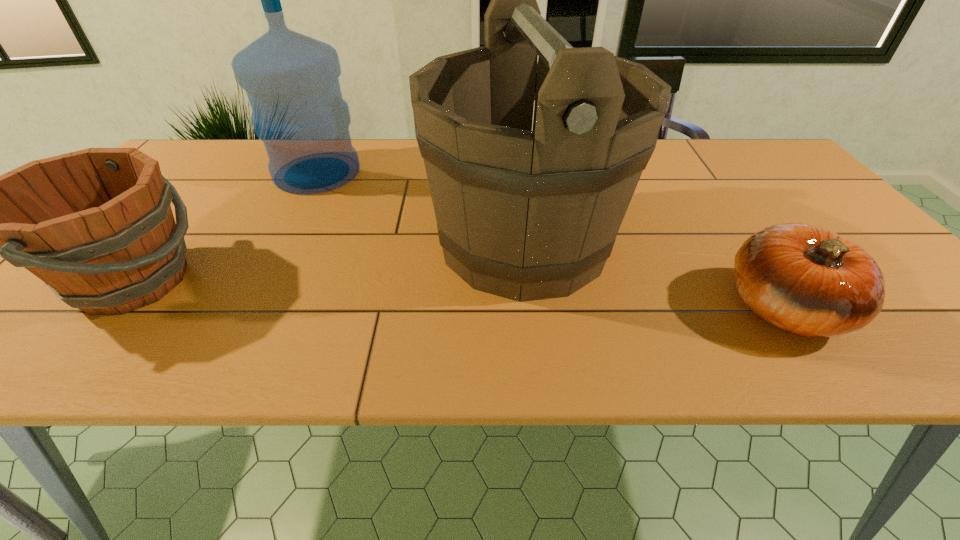
Where is `blank region between the second object from left to right and the taller bucket`? The height and width of the screenshot is (540, 960). blank region between the second object from left to right and the taller bucket is located at coordinates (420, 207).

The width and height of the screenshot is (960, 540). What are the coordinates of `object that is the second closest to the third object from right to left` in the screenshot? It's located at (536, 212).

This screenshot has height=540, width=960. What are the coordinates of `object that is the third closest one to the shortest object` in the screenshot? It's located at (96, 226).

The height and width of the screenshot is (540, 960). I want to click on free location that satisfies the following two spatial constraints: 1. on the front side of the shortest object; 2. on the right side of the taller bucket, so click(x=531, y=308).

The width and height of the screenshot is (960, 540). I want to click on vacant region that satisfies the following two spatial constraints: 1. on the front side of the rightmost object; 2. on the left side of the right bucket, so click(x=531, y=308).

This screenshot has height=540, width=960. In order to click on blank space that satisfies the following two spatial constraints: 1. on the handle side of the leftmost object; 2. on the back side of the rightmost object in this screenshot , I will do `click(111, 308)`.

Identify the location of vacant space that satisfies the following two spatial constraints: 1. on the handle side of the shorter bucket; 2. on the left side of the shortest object. Image resolution: width=960 pixels, height=540 pixels. (111, 308).

What are the coordinates of `free spot that satisfies the following two spatial constraints: 1. on the front side of the third object from right to left; 2. on the handle side of the left bucket` in the screenshot? It's located at (260, 281).